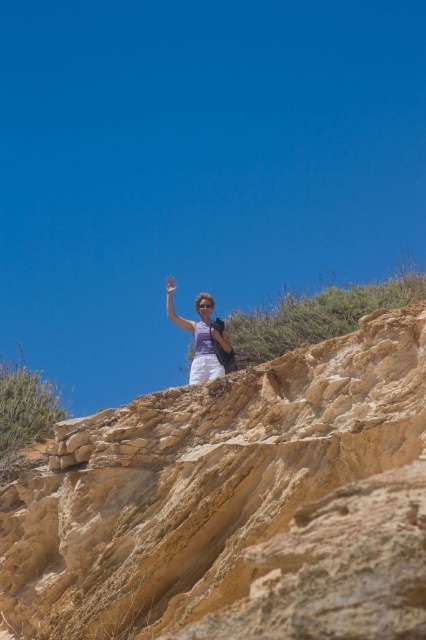
You are a photographer trying to capture the best angle of the cliff. You notice two points marked on your camera screen at coordinates point (91, 483) and point (204, 340). Which point is nearer to your camera lens?

Point (91, 483) is closer to the camera than point (204, 340), so the photographer should focus on that point for a closer view.

You are a photographer trying to capture the matte purple shirt at upper center without the smooth sandstone cliff at upper center blocking it. Can you adjust your position to achieve this?

The smooth sandstone cliff at upper center is in front of the matte purple shirt at upper center, so moving your position to the side or behind the cliff might allow you to capture the shirt without obstruction.

You are a geologist examining the image. You need to locate the smooth sandstone cliff at upper center. What coordinates should you focus on?

The smooth sandstone cliff at upper center is located at coordinates point (236, 504).